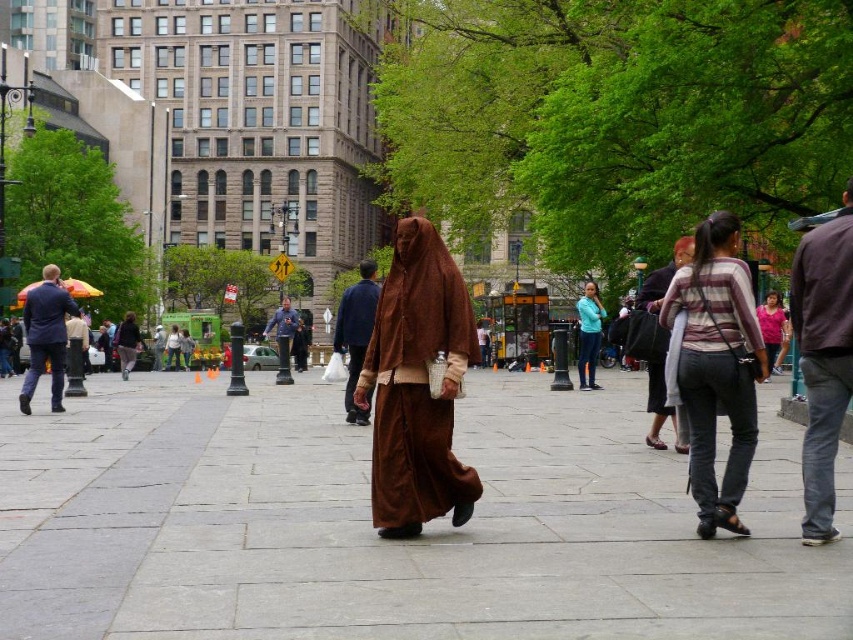
Question: Which point is farther from the camera taking this photo?

Choices:
 (A) (401, 419)
 (B) (479, 410)
 (C) (131, 337)

Answer: (C)

Question: Among these objects, which one is nearest to the camera?

Choices:
 (A) blue denim jacket at center
 (B) matte black suit at left
 (C) dark brown leather jacket at right
 (D) brown fabric hood at center

Answer: (C)

Question: Is gray stone pavement at center thinner than matte brown robe at center?

Choices:
 (A) no
 (B) yes

Answer: (A)

Question: Is matte black suit at left wider than blue denim jacket at center?

Choices:
 (A) no
 (B) yes

Answer: (A)

Question: Among these points, which one is nearest to the camera?

Choices:
 (A) (672, 563)
 (B) (131, 349)
 (C) (598, 304)

Answer: (A)

Question: Is striped sweater at right bigger than matte black suit at left?

Choices:
 (A) yes
 (B) no

Answer: (B)